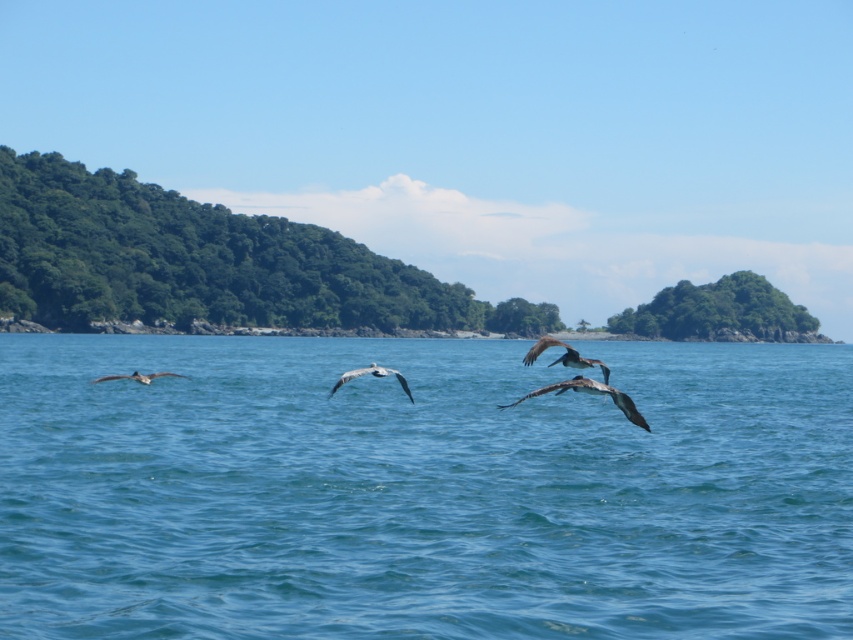
You are standing on a cliff overlooking the coastal scene. You notice the blue water at center and the gray matte pelican at center. Which one appears taller from your perspective?

The blue water at center appears taller than the gray matte pelican at center from your perspective because the blue water at center has a greater height compared to the gray matte pelican at center.

You are a photographer standing at the camera position. You want to capture a closeup shot of the gray matte pelican at center. Given that your telephoto lens can focus on objects within 20 meters, will you need to adjust your position to get a clear image?

The gray matte pelican at center is 23.35 meters from the camera, which is beyond the 20 meters focus range of your telephoto lens. You will need to move closer to the gray matte pelican at center to ensure it is within the 20 meters range for a clear closeup.